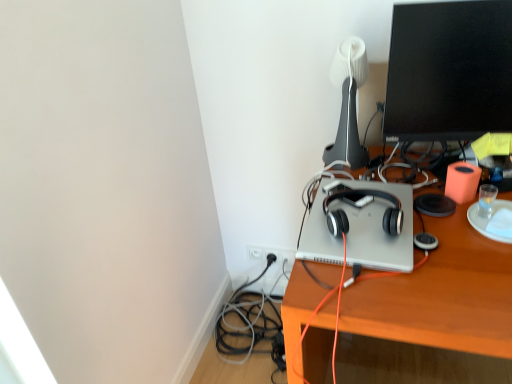
Question: Based on their positions, is black glossy monitor at upper right located to the left or right of wooden desk at center?

Choices:
 (A) left
 (B) right

Answer: (A)

Question: Considering the positions of point (449, 72) and point (467, 344), is point (449, 72) closer or farther from the camera than point (467, 344)?

Choices:
 (A) closer
 (B) farther

Answer: (B)

Question: Which is farther from the wooden desk at center?

Choices:
 (A) satin black headphones at center
 (B) white matte table lamp at upper center
 (C) silver metallic laptop at center
 (D) black glossy monitor at upper right

Answer: (D)

Question: Which of these objects is positioned farthest from the black glossy monitor at upper right?

Choices:
 (A) white matte table lamp at upper center
 (B) silver metallic laptop at center
 (C) satin black headphones at center
 (D) wooden desk at center

Answer: (D)